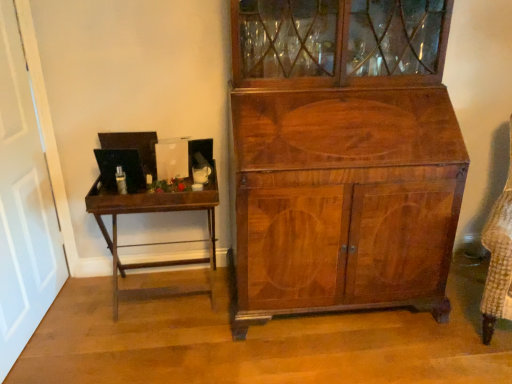
Locate an element on the screen. The height and width of the screenshot is (384, 512). free space to the left of wooden table at left is located at coordinates (75, 314).